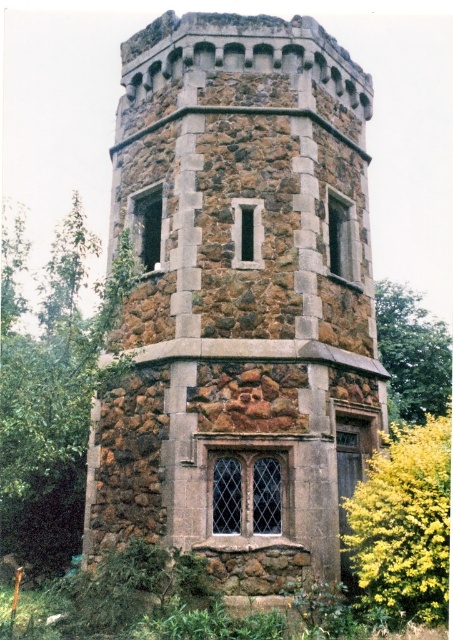
Between point (256, 586) and point (428, 369), which one is positioned behind?

The point (428, 369) is more distant.

Between brown stone tower at center and green leafy tree at right, which one has more height?

Standing taller between the two is brown stone tower at center.

Does point (333, 138) come closer to viewer compared to point (444, 324)?

Yes, point (333, 138) is closer to viewer.

This screenshot has height=640, width=453. I want to click on brown stone tower at center, so click(240, 300).

Who is positioned more to the left, green leafy tree at left or green leafy tree at right?

Positioned to the left is green leafy tree at left.

Measure the distance between green leafy tree at left and camera.

green leafy tree at left and camera are 9.64 meters apart.

Where is `green leafy tree at left`? The width and height of the screenshot is (453, 640). green leafy tree at left is located at coordinates (53, 401).

Measure the distance between brown stone tower at center and yellow leafy bush at lower right.

A distance of 4.85 meters exists between brown stone tower at center and yellow leafy bush at lower right.

Based on the photo, which is above, brown stone tower at center or yellow leafy bush at lower right?

brown stone tower at center is above.

Who is more forward, (182, 253) or (438, 417)?

Positioned in front is point (182, 253).

Locate an element on the screen. Image resolution: width=453 pixels, height=640 pixels. brown stone tower at center is located at coordinates (240, 300).